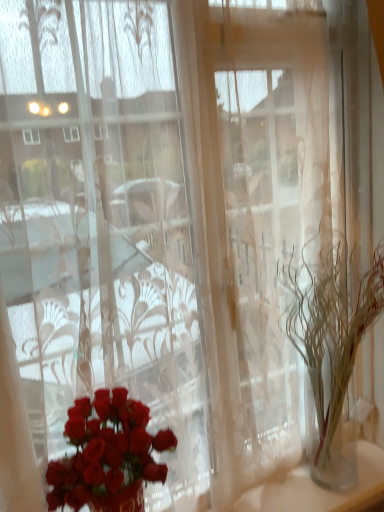
Question: Considering the positions of shiny red roses at lower left and translucent glass vase at right in the image, is shiny red roses at lower left taller or shorter than translucent glass vase at right?

Choices:
 (A) tall
 (B) short

Answer: (B)

Question: Would you say shiny red roses at lower left is to the left or to the right of translucent glass vase at right in the picture?

Choices:
 (A) left
 (B) right

Answer: (A)

Question: Is shiny red roses at lower left spatially inside translucent glass vase at right, or outside of it?

Choices:
 (A) inside
 (B) outside

Answer: (B)

Question: Does point (327, 372) appear closer or farther from the camera than point (66, 412)?

Choices:
 (A) farther
 (B) closer

Answer: (A)

Question: From a real-world perspective, is translucent glass vase at right above or below shiny red roses at lower left?

Choices:
 (A) below
 (B) above

Answer: (B)

Question: Is translucent glass vase at right wider or thinner than shiny red roses at lower left?

Choices:
 (A) thin
 (B) wide

Answer: (B)

Question: Is translucent glass vase at right in front of or behind shiny red roses at lower left in the image?

Choices:
 (A) behind
 (B) front

Answer: (A)